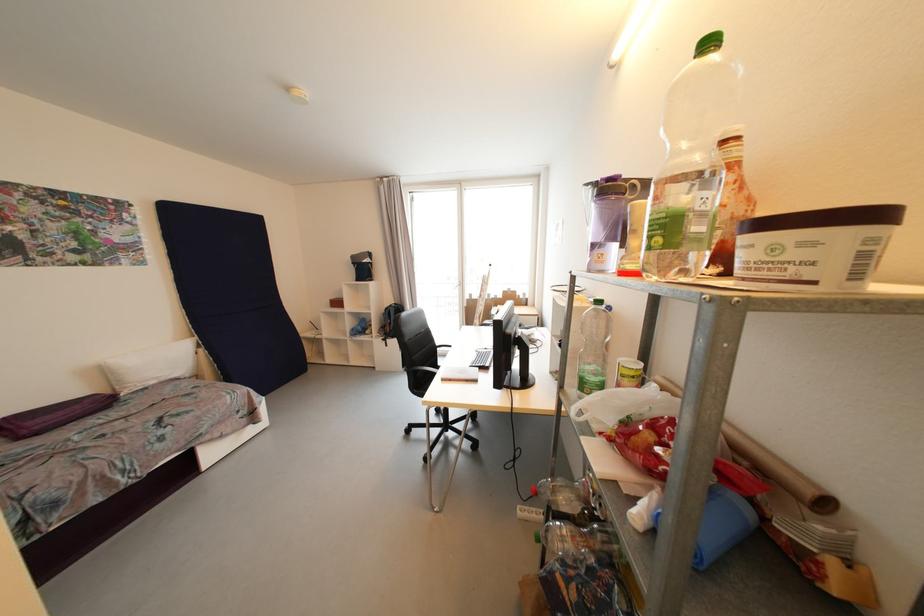
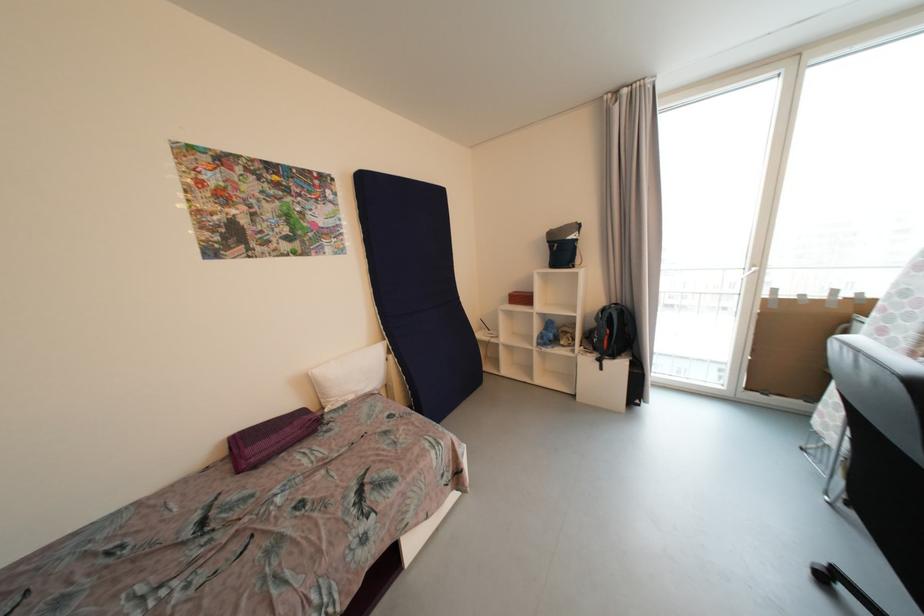
In the second image, find the point that corresponds to the point at 343,304 in the first image.

(528, 300)